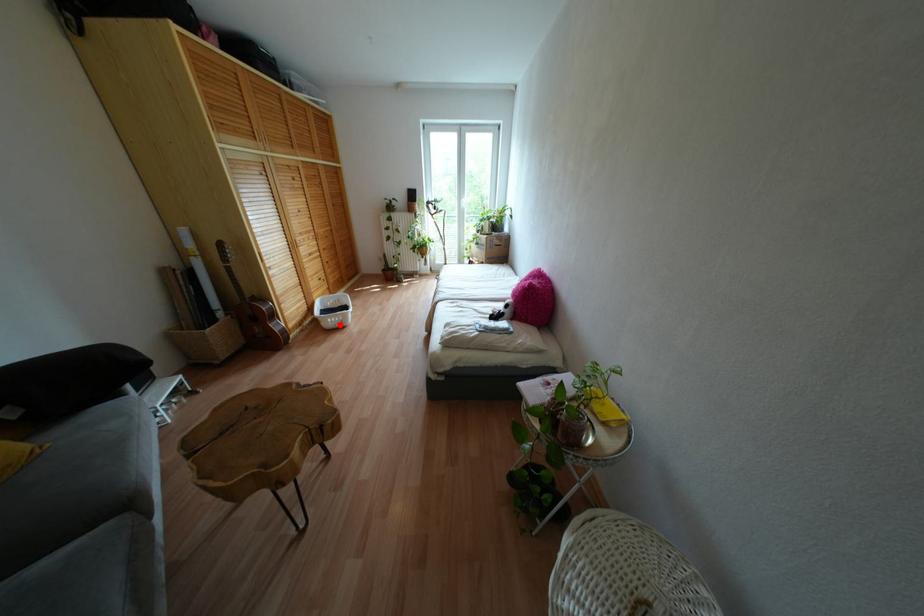
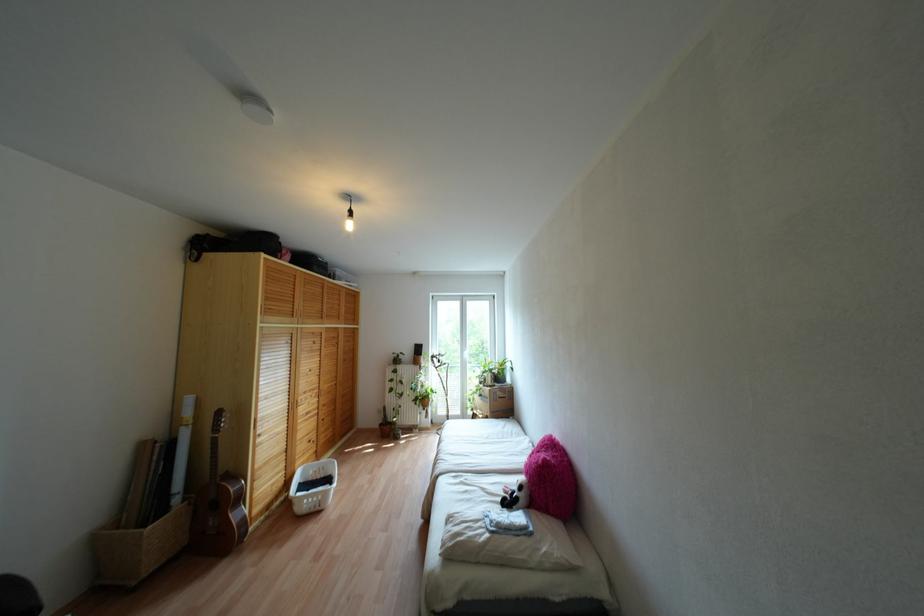
The point at the highlighted location is marked in the first image. Where is the corresponding point in the second image?

(317, 508)